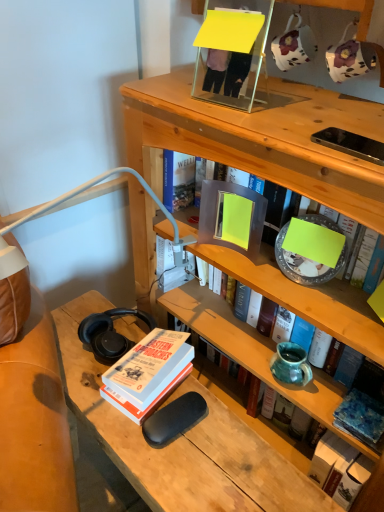
The image size is (384, 512). In order to click on free location above hardcover book at lower left, which is the 3th book in top-to-bottom order (from a real-world perspective) in this screenshot , I will do `click(148, 364)`.